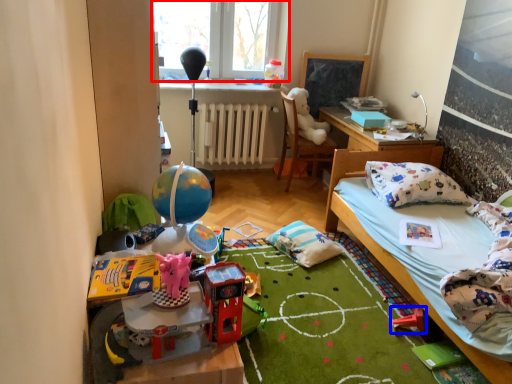
Question: Which of the following is the closest to the observer, window (highlighted by a red box) or toy (highlighted by a blue box)?

Choices:
 (A) window
 (B) toy

Answer: (B)